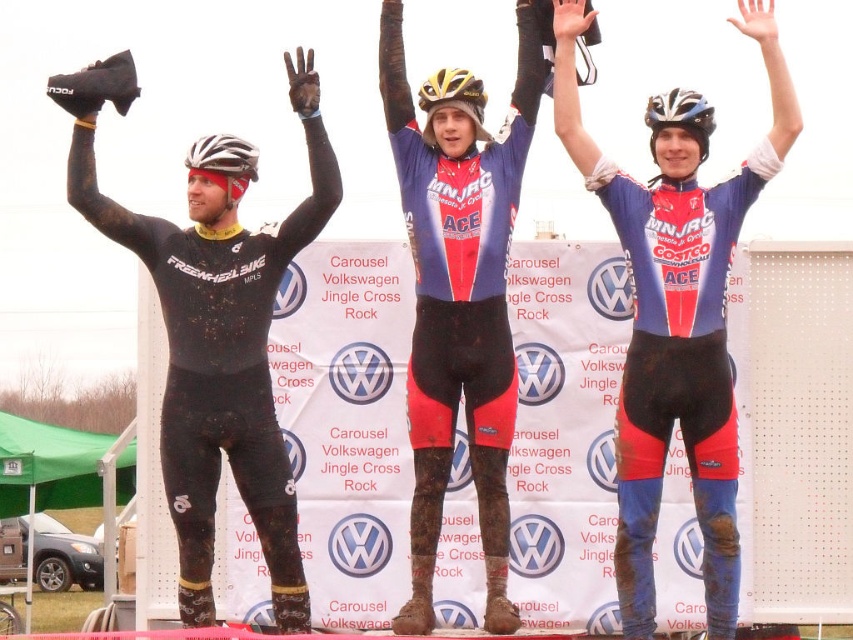
Is matte black suit at left above shiny blue helmet at center?

Incorrect, matte black suit at left is not positioned above shiny blue helmet at center.

Between point (200, 612) and point (665, 108), which one is positioned in front?

Point (665, 108) is in front.

Image resolution: width=853 pixels, height=640 pixels. What are the coordinates of `matte black suit at left` in the screenshot? It's located at 213,336.

Between matte black suit at left and yellow matte bicycle helmet at center, which one has more height?

matte black suit at left

Is matte black suit at left further to the viewer compared to yellow matte bicycle helmet at center?

That is False.

Find the location of a particular element. The height and width of the screenshot is (640, 853). matte black suit at left is located at coordinates (213, 336).

Does white matte bicycle helmet at upper left have a smaller size compared to yellow matte bicycle helmet at center?

Yes, white matte bicycle helmet at upper left is smaller than yellow matte bicycle helmet at center.

Who is higher up, white matte bicycle helmet at upper left or yellow matte bicycle helmet at center?

Positioned higher is yellow matte bicycle helmet at center.

Between point (241, 195) and point (422, 138), which one is positioned behind?

The point (241, 195) is behind.

The height and width of the screenshot is (640, 853). Find the location of `white matte bicycle helmet at upper left`. white matte bicycle helmet at upper left is located at coordinates (224, 163).